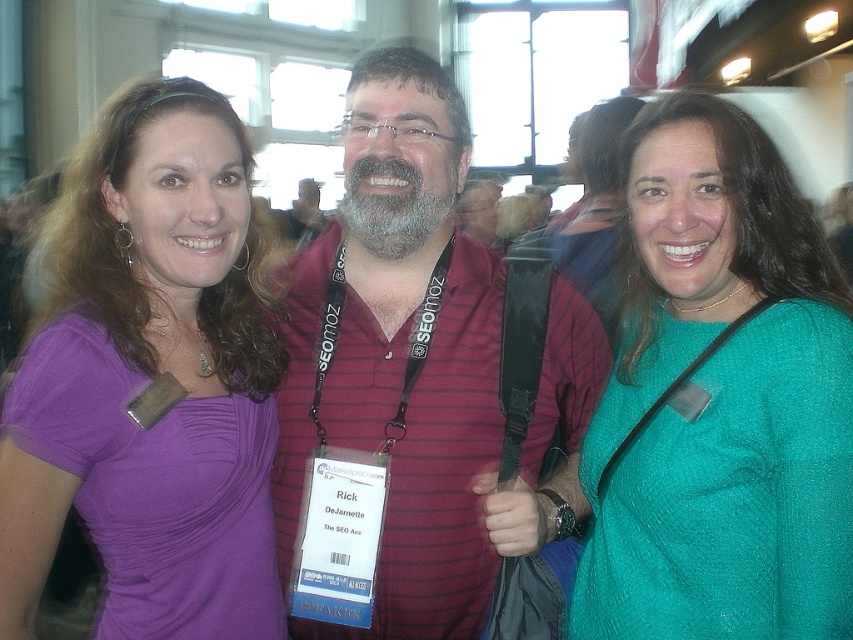
You are a photographer adjusting the camera settings to ensure all subjects are in focus. Given that the matte purple shirt at left and the teal textured sweater at center are of different sizes, which one might require more careful adjustment to avoid blurring due to its size?

The matte purple shirt at left is larger in size compared to the teal textured sweater at center, so it might require more careful adjustment to avoid blurring due to its size.